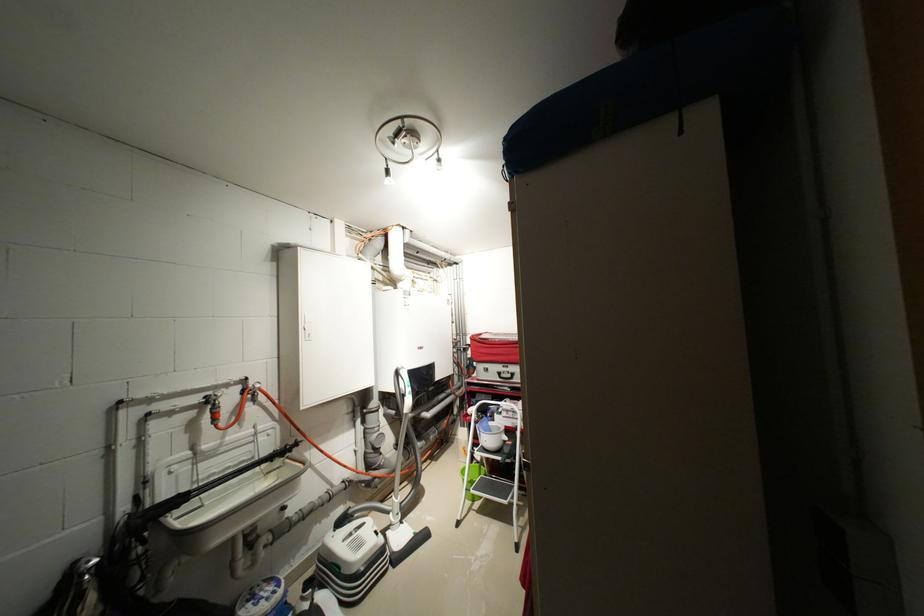
This screenshot has height=616, width=924. Describe the element at coordinates (312, 323) in the screenshot. I see `the white cabinet lock` at that location.